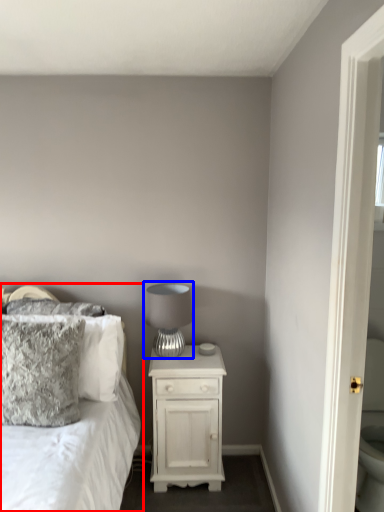
Question: Among these objects, which one is farthest to the camera, bed (highlighted by a red box) or table lamp (highlighted by a blue box)?

Choices:
 (A) bed
 (B) table lamp

Answer: (B)